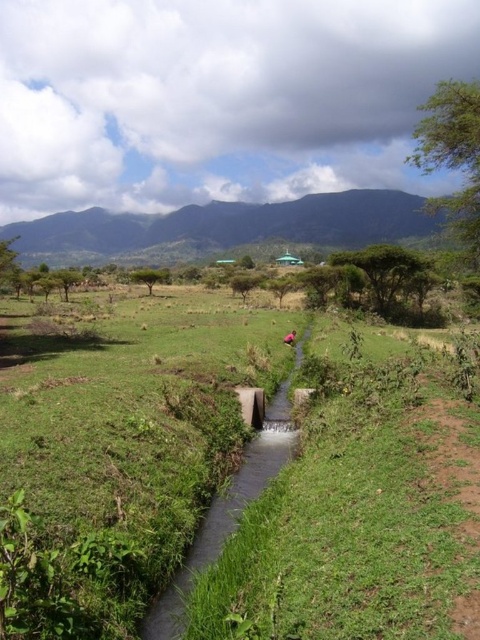
This screenshot has height=640, width=480. Describe the element at coordinates (120, 452) in the screenshot. I see `green grassy at center` at that location.

Who is higher up, green grassy at center or green concrete stream at center?

green grassy at center is higher up.

Which is behind, point (13, 305) or point (162, 595)?

The point (13, 305) is more distant.

Find the location of `green grassy at center`. green grassy at center is located at coordinates (120, 452).